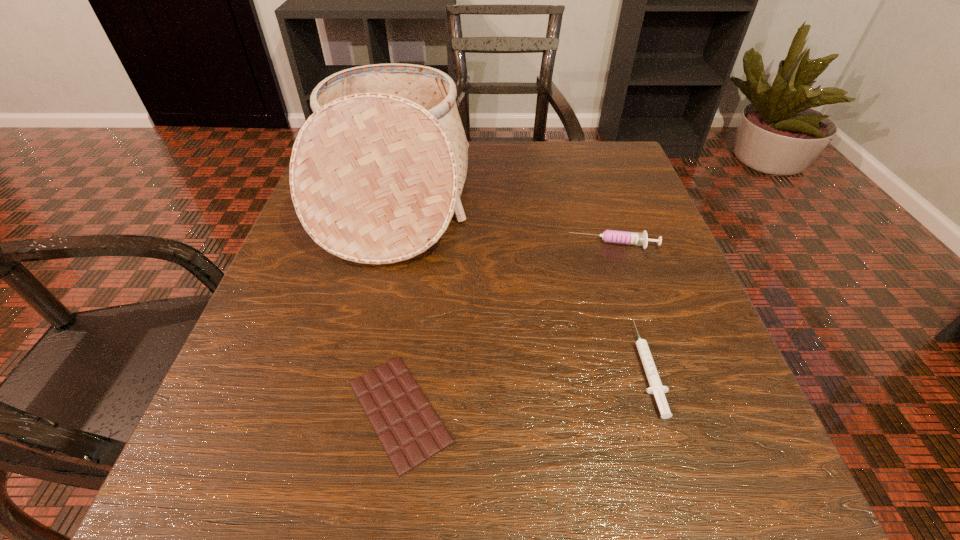
The width and height of the screenshot is (960, 540). Find the location of `unoccupied position between the shortest object and the tallest object`. unoccupied position between the shortest object and the tallest object is located at coordinates (396, 304).

Identify the location of vacant space in between the nearer syringe and the shortest object. The image size is (960, 540). (523, 389).

The width and height of the screenshot is (960, 540). I want to click on free space that is in between the basket and the second shortest object, so tap(520, 282).

You are a GUI agent. You are given a task and a screenshot of the screen. Output one action in this format:
    pyautogui.click(x=<x>, y=<y>)
    Task: Click on the empty location between the chocolate bar and the tallest object
    
    Given the screenshot: What is the action you would take?
    pyautogui.click(x=396, y=304)

What are the coordinates of `free area in between the shortest object and the farther syringe` in the screenshot? It's located at (507, 328).

At what (x,y) coordinates should I click in order to perform the action: click on free area in between the third tallest object and the tallest object. Please return your answer as a coordinate pair (x, y). The height and width of the screenshot is (540, 960). Looking at the image, I should click on click(520, 282).

Locate an element on the screen. This screenshot has height=540, width=960. free space between the chocolate bar and the farther syringe is located at coordinates (507, 328).

This screenshot has height=540, width=960. Identify the location of vacant area between the tallest object and the chocolate bar. (396, 304).

You are a GUI agent. You are given a task and a screenshot of the screen. Output one action in this format:
    pyautogui.click(x=<x>, y=<y>)
    Task: Click on the vacant space that is in between the nearer syringe and the shortest object
    The height and width of the screenshot is (540, 960).
    Given the screenshot: What is the action you would take?
    pyautogui.click(x=523, y=389)

Locate an element on the screen. The image size is (960, 540). empty location between the nearer syringe and the basket is located at coordinates [x=520, y=282].